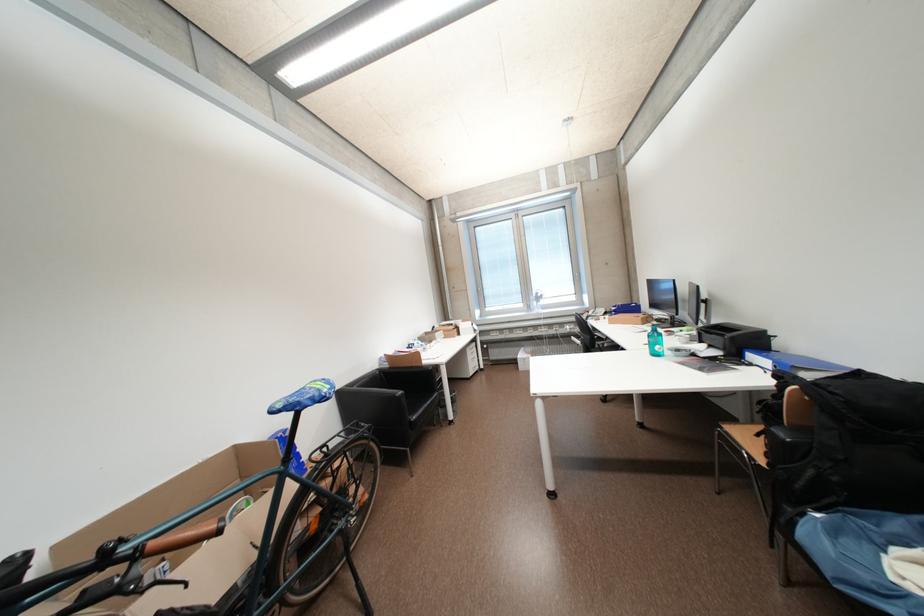
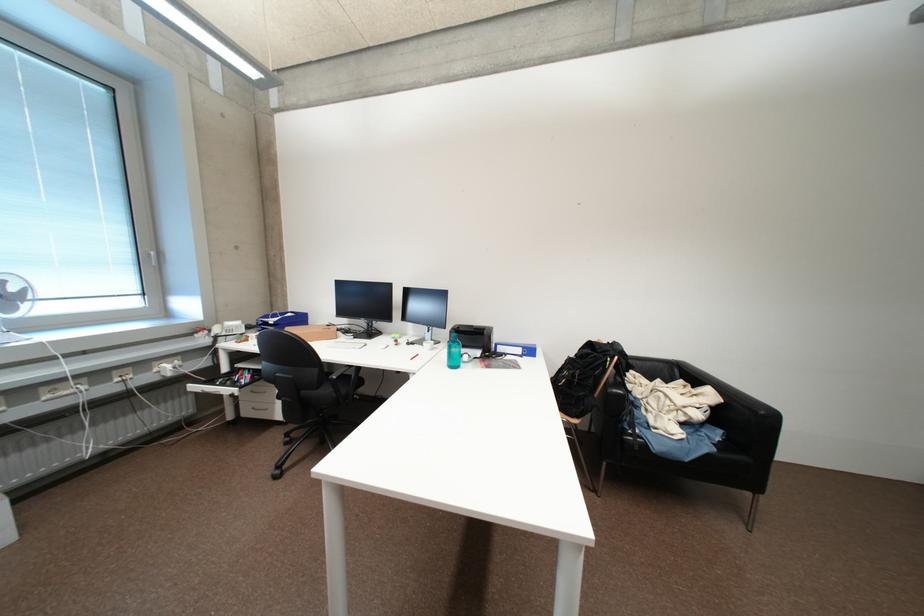
Find the pixel in the second image that matches [599,315] in the first image.

(225, 331)